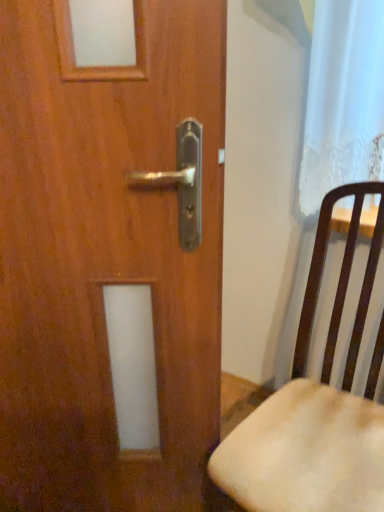
Describe the element at coordinates (316, 406) in the screenshot. Image resolution: width=384 pixels, height=512 pixels. I see `wooden chair at right` at that location.

Where is `wooden chair at right`? wooden chair at right is located at coordinates (316, 406).

You are a GUI agent. You are given a task and a screenshot of the screen. Output one action in this format:
    pyautogui.click(x=<x>, y=<y>)
    Task: Click on the wooden door at center
    
    Given the screenshot: What is the action you would take?
    pyautogui.click(x=105, y=260)

Describe the element at coordinates (105, 260) in the screenshot. I see `wooden door at center` at that location.

The height and width of the screenshot is (512, 384). What are the coordinates of `wooden chair at right` in the screenshot? It's located at (316, 406).

Does wooden chair at right appear on the right side of wooden door at center?

Indeed, wooden chair at right is positioned on the right side of wooden door at center.

Does wooden chair at right lie in front of wooden door at center?

Yes, it is in front of wooden door at center.

Is point (275, 450) farther from viewer compared to point (68, 369)?

No, it is in front of (68, 369).

From the image's perspective, which one is positioned lower, wooden chair at right or wooden door at center?

wooden chair at right.

From a real-world perspective, does wooden chair at right stand above wooden door at center?

Incorrect, from a real-world perspective, wooden chair at right is lower than wooden door at center.

Does wooden chair at right have a lesser width compared to wooden door at center?

In fact, wooden chair at right might be wider than wooden door at center.

Considering the relative sizes of wooden chair at right and wooden door at center in the image provided, is wooden chair at right shorter than wooden door at center?

Correct, wooden chair at right is not as tall as wooden door at center.

Between wooden chair at right and wooden door at center, which one has smaller size?

wooden door at center is smaller.

Is wooden door at center inside wooden chair at right?

No, wooden chair at right does not contain wooden door at center.

Is wooden chair at right beside wooden door at center?

No.

Is wooden chair at right oriented towards wooden door at center?

No, wooden chair at right is not oriented towards wooden door at center.

How many degrees apart are the facing directions of wooden chair at right and wooden door at center?

The facing directions of wooden chair at right and wooden door at center are 31.7 degrees apart.

How distant is wooden chair at right from wooden door at center?

14.83 inches.

Locate an element on the screen. The image size is (384, 512). chair on the right of wooden door at center is located at coordinates 316,406.

Is wooden door at center at the left side of wooden chair at right?

Yes.

Is wooden door at center in front of or behind wooden chair at right in the image?

wooden door at center is positioned farther from the viewer than wooden chair at right.

Does point (5, 241) come closer to viewer compared to point (287, 452)?

Yes, it is.

From the image's perspective, which is above, wooden door at center or wooden chair at right?

From the image's view, wooden door at center is above.

From a real-world perspective, between wooden door at center and wooden chair at right, who is vertically higher?

wooden door at center is physically above.

Looking at their sizes, would you say wooden door at center is wider or thinner than wooden chair at right?

In the image, wooden door at center appears to be more narrow than wooden chair at right.

Can you confirm if wooden door at center is taller than wooden chair at right?

Correct, wooden door at center is much taller as wooden chair at right.

Considering the sizes of objects wooden door at center and wooden chair at right in the image provided, who is bigger, wooden door at center or wooden chair at right?

With larger size is wooden chair at right.

Could wooden chair at right be considered to be inside wooden door at center?

No, wooden door at center does not contain wooden chair at right.

Is wooden door at center next to wooden chair at right?

No.

Could you tell me if wooden door at center is facing wooden chair at right?

No, wooden door at center does not turn towards wooden chair at right.

What's the angular difference between wooden door at center and wooden chair at right's facing directions?

wooden door at center and wooden chair at right are facing 31.7 degrees away from each other.

Locate an element on the screen. The image size is (384, 512). chair below the wooden door at center (from the image's perspective) is located at coordinates (316, 406).

Where is `chair that is under the wooden door at center (from a real-world perspective)`? chair that is under the wooden door at center (from a real-world perspective) is located at coordinates (316, 406).

I want to click on door above the wooden chair at right (from the image's perspective), so click(x=105, y=260).